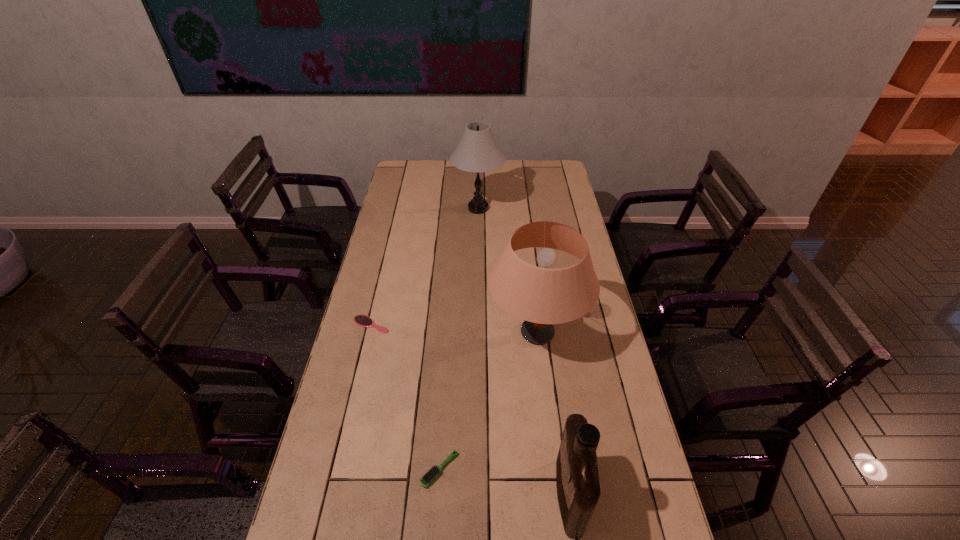
The height and width of the screenshot is (540, 960). In the image, there is a desktop. Find the location of `vacant space at the right edge`. vacant space at the right edge is located at coordinates (608, 372).

Identify the location of vacant space in between the lampshade and the taller hairbrush. (489, 401).

You are a GUI agent. You are given a task and a screenshot of the screen. Output one action in this format:
    pyautogui.click(x=<x>, y=<y>)
    Task: Click on the free spot between the lampshade and the third shortest object
    The width and height of the screenshot is (960, 540).
    Given the screenshot: What is the action you would take?
    pyautogui.click(x=553, y=415)

Where is `vacant area that lies between the third shortest object and the lampshade`? The height and width of the screenshot is (540, 960). vacant area that lies between the third shortest object and the lampshade is located at coordinates (553, 415).

The image size is (960, 540). I want to click on free spot between the liquor and the farthest object, so click(x=523, y=353).

This screenshot has height=540, width=960. I want to click on free space that is in between the farthest object and the nearer hairbrush, so click(x=459, y=339).

At what (x,y) coordinates should I click in order to perform the action: click on empty space that is in between the taller hairbrush and the lampshade. Please return your answer as a coordinate pair (x, y). The width and height of the screenshot is (960, 540). Looking at the image, I should click on (489, 401).

This screenshot has width=960, height=540. In order to click on free space between the taller hairbrush and the liquor in this screenshot , I will do `click(504, 483)`.

You are a GUI agent. You are given a task and a screenshot of the screen. Output one action in this format:
    pyautogui.click(x=<x>, y=<y>)
    Task: Click on the free space between the lampshade and the left hairbrush
    Image resolution: width=960 pixels, height=540 pixels.
    Given the screenshot: What is the action you would take?
    pyautogui.click(x=454, y=328)

Select which object appears as the third closest to the shorter hairbrush. Please provide its 2D coordinates. Your answer should be formatted as a tuple, i.e. [(x, y)], where the tuple contains the x and y coordinates of a point satisfying the conditions above.

[(477, 151)]